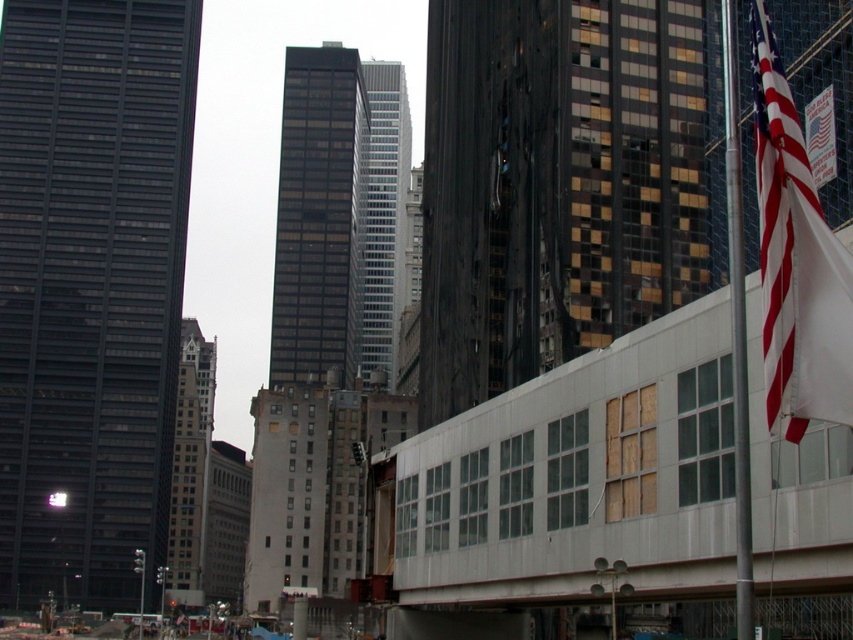
Can you confirm if red-white striped flag at right is smaller than silver metallic pole at right?

Yes.

Between point (792, 348) and point (744, 394), which one is positioned behind?

The point (744, 394) is behind.

This screenshot has width=853, height=640. In order to click on red-white striped flag at right in this screenshot , I will do `click(796, 260)`.